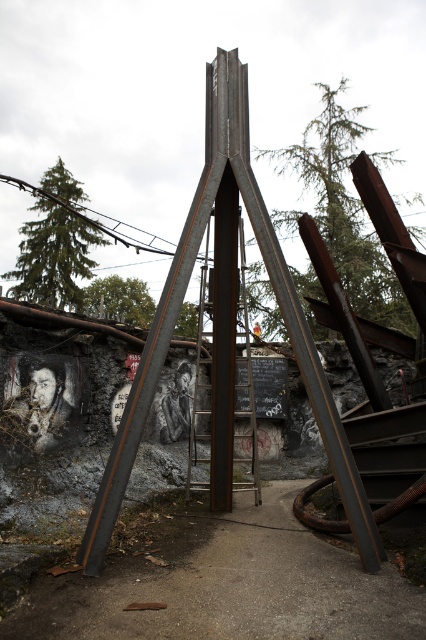
You are standing at the base of the metal structure and see two points marked on the structure. The first point is at coordinates point (157,525) and the second is at point (247,381). Which point is closer to you?

Point (157,525) is in front of point (247,381), so it is closer to you.

You are a painter who needs to set up an easel. You see the concrete at center and the rusty metal ladder at center. Which surface can you place your easel on?

The concrete at center is positioned under the rusty metal ladder at center, so you can place your easel on the concrete at center as it is a stable surface below the ladder.

You are a painter standing at the center of the scene. You need to paint the concrete at center and the rusty metal ladder at center. Which object should you paint first if you want to paint the one closest to you?

The concrete at center is in front of the rusty metal ladder at center, so you should paint the concrete at center first since it is closer to you.